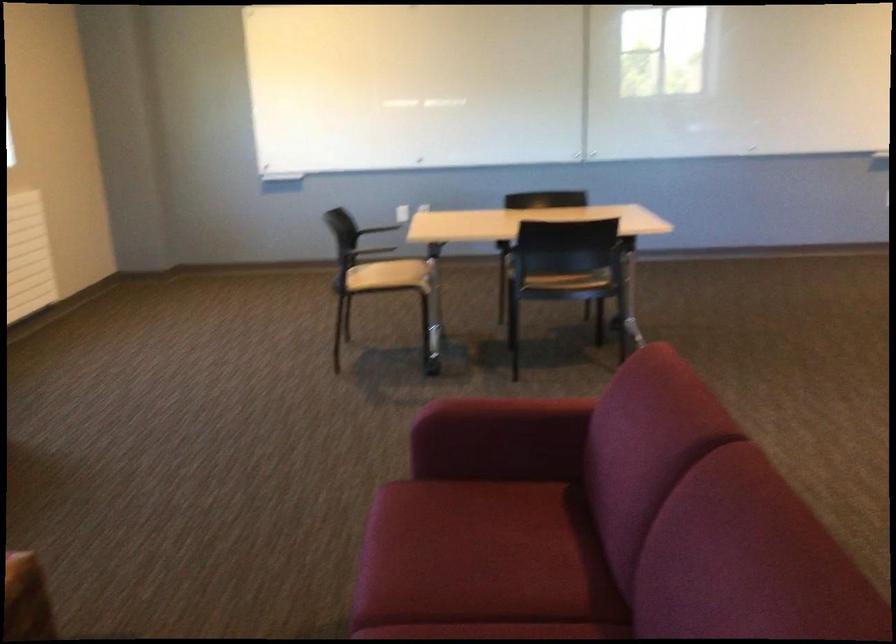
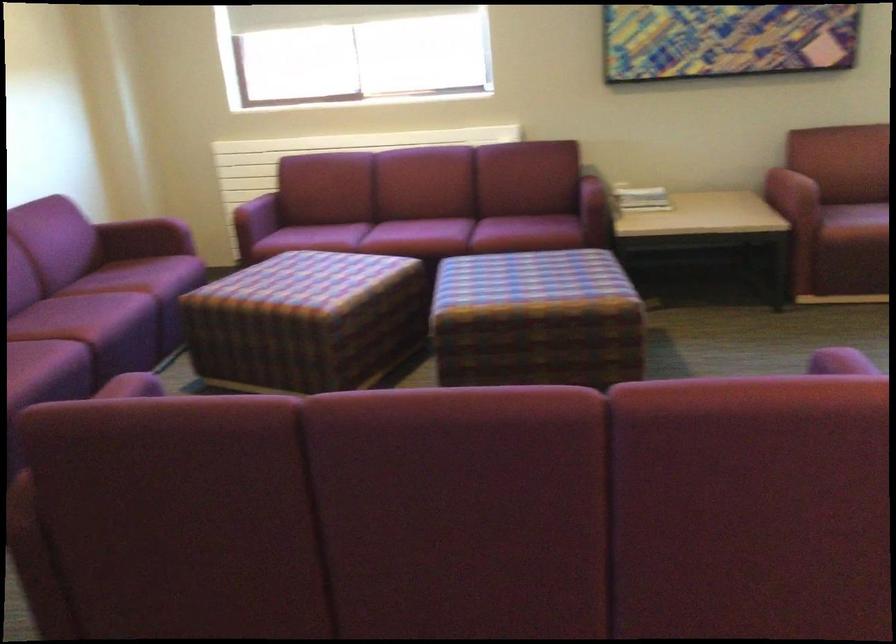
Question: I am providing you with two images of the same scene from different viewpoints. Please identify which objects are invisible in image2.

Choices:
 (A) red chair armrest
 (B) pink plant pot
 (C) red sofa armrest
 (D) red sofa sitting surface

Answer: (D)